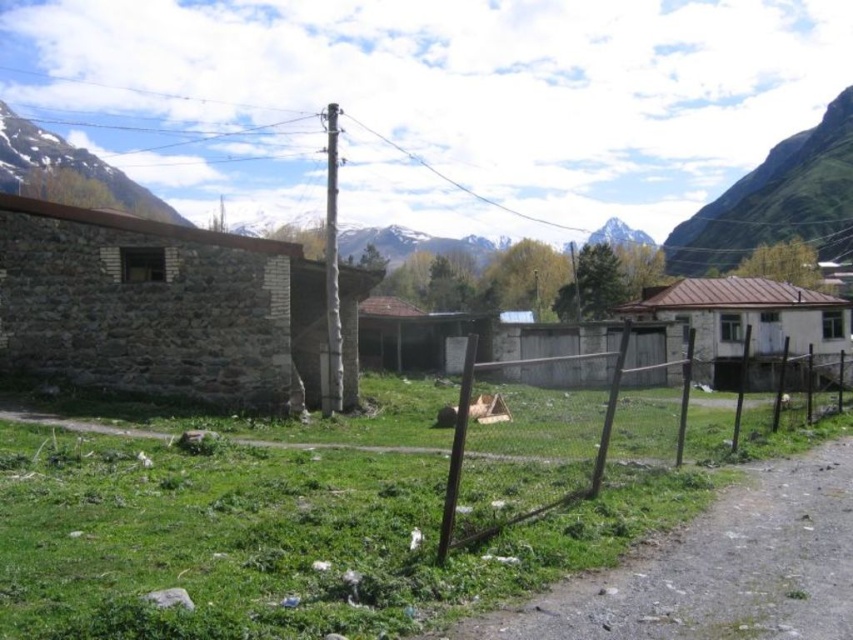
Which is more to the left, metallic wire fence at center or snowy rock mountain at upper left?

Positioned to the left is snowy rock mountain at upper left.

Does metallic wire fence at center come in front of snowy rock mountain at upper left?

Yes, metallic wire fence at center is closer to the viewer.

This screenshot has height=640, width=853. I want to click on metallic wire fence at center, so click(598, 442).

This screenshot has width=853, height=640. What are the coordinates of `metallic wire fence at center` in the screenshot? It's located at (598, 442).

Between point (525, 636) and point (476, 346), which one is positioned in front?

Positioned in front is point (525, 636).

Is gravelly dirt path at center to the right of metallic wire fence at center from the viewer's perspective?

Incorrect, gravelly dirt path at center is not on the right side of metallic wire fence at center.

Does point (822, 545) come farther from viewer compared to point (775, 422)?

That is False.

I want to click on gravelly dirt path at center, so click(717, 568).

Which is below, green grassy mountain at upper right or snowy rock mountain at upper left?

green grassy mountain at upper right is lower down.

Can you confirm if green grassy mountain at upper right is positioned below snowy rock mountain at upper left?

Correct, green grassy mountain at upper right is located below snowy rock mountain at upper left.

Who is more forward, [837,196] or [132,198]?

Point [837,196] is in front.

Locate an element on the screen. green grassy mountain at upper right is located at coordinates (776, 200).